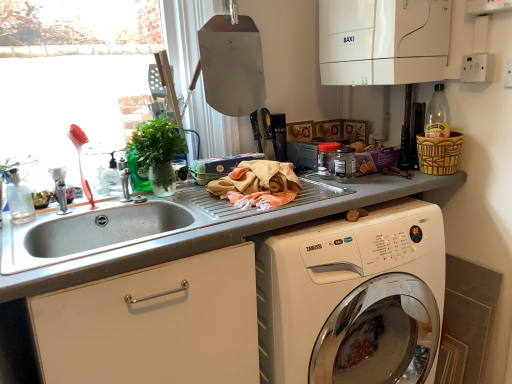
Identify the location of empty space that is to the right of transparent plastic jar at center, the 2th appliance in the bottom-to-top sequence. The width and height of the screenshot is (512, 384). (375, 181).